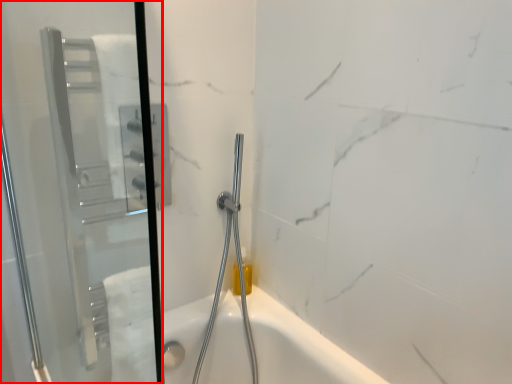
Question: From the image's perspective, where is screen door (annotated by the red box) located relative to shower?

Choices:
 (A) below
 (B) above

Answer: (B)